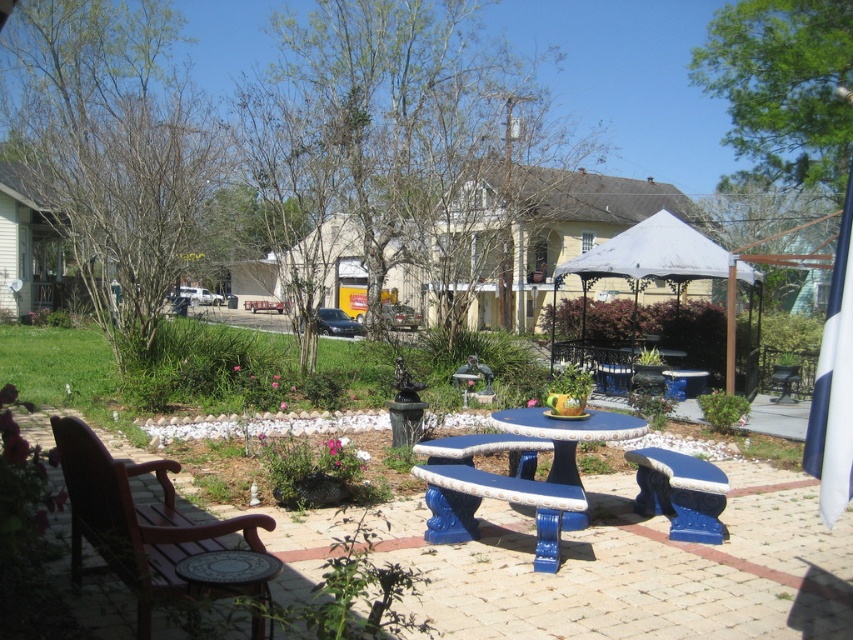
Does brown wood chair at left have a lesser width compared to blue painted stone picnic table at center?

No.

This screenshot has height=640, width=853. Find the location of `brown wood chair at left`. brown wood chair at left is located at coordinates (134, 520).

Is point (61, 464) closer to camera compared to point (500, 499)?

Yes, point (61, 464) is closer to viewer.

Locate an element on the screen. brown wood chair at left is located at coordinates (134, 520).

Does brown wood chair at left appear over blue glossy table at center?

Yes, brown wood chair at left is above blue glossy table at center.

Is brown wood chair at left smaller than blue glossy table at center?

No, brown wood chair at left is not smaller than blue glossy table at center.

You are a GUI agent. You are given a task and a screenshot of the screen. Output one action in this format:
    pyautogui.click(x=<x>, y=<y>)
    Task: Click on the brown wood chair at left
    Image resolution: width=853 pixels, height=640 pixels.
    Given the screenshot: What is the action you would take?
    pyautogui.click(x=134, y=520)

At what (x,y) coordinates should I click in order to perform the action: click on brown wood chair at left. Please return your answer as a coordinate pair (x, y). This screenshot has width=853, height=640. Looking at the image, I should click on (134, 520).

Is point (553, 486) closer to viewer compared to point (534, 424)?

Yes, point (553, 486) is in front of point (534, 424).

Does blue painted wood bench at center have a greater height compared to blue glossy table at center?

Incorrect, blue painted wood bench at center's height is not larger of blue glossy table at center's.

Is point (462, 468) in front of point (570, 436)?

That is False.

Identify the location of blue painted wood bench at center. [x=495, y=499].